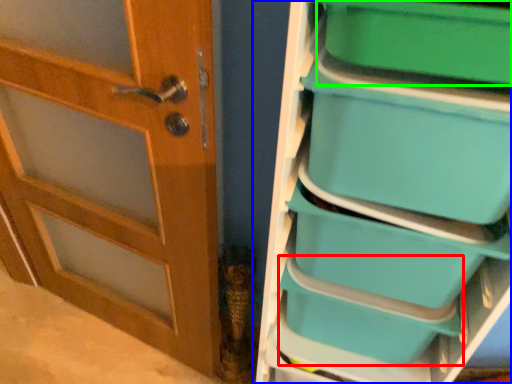
Question: Estimate the real-world distances between objects in this image. Which object is closer to storage box (highlighted by a red box), shelf (highlighted by a blue box) or storage box (highlighted by a green box)?

Choices:
 (A) shelf
 (B) storage box

Answer: (A)